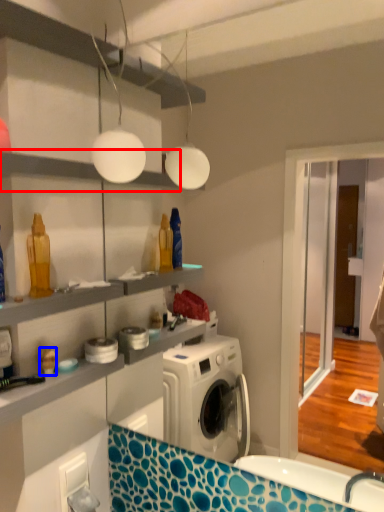
Question: Which point is closer to the camera, shelf (highlighted by a red box) or toy (highlighted by a blue box)?

Choices:
 (A) shelf
 (B) toy

Answer: (A)